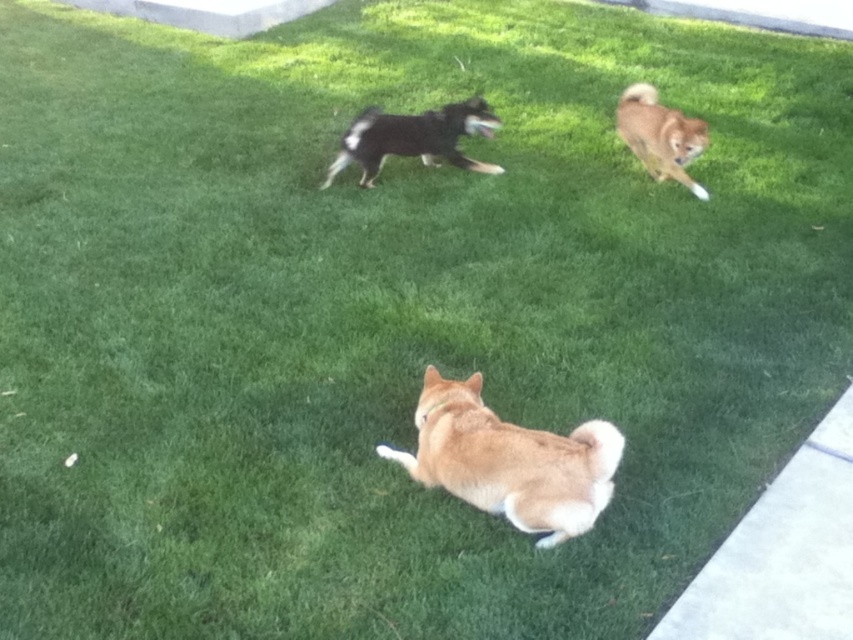
Question: Can you confirm if light brown fur at center is wider than light brown fur at upper right?

Choices:
 (A) yes
 (B) no

Answer: (A)

Question: Which object is positioned closest to the light brown fur at upper right?

Choices:
 (A) black glossy dog at center
 (B) light brown fur at center

Answer: (A)

Question: Is black glossy dog at center positioned in front of light brown fur at upper right?

Choices:
 (A) yes
 (B) no

Answer: (B)

Question: Which of the following is the closest to the observer?

Choices:
 (A) (654, 102)
 (B) (482, 406)
 (C) (405, 134)

Answer: (B)

Question: Which point is closer to the camera?

Choices:
 (A) black glossy dog at center
 (B) light brown fur at upper right

Answer: (B)

Question: Does light brown fur at center appear on the right side of light brown fur at upper right?

Choices:
 (A) no
 (B) yes

Answer: (A)